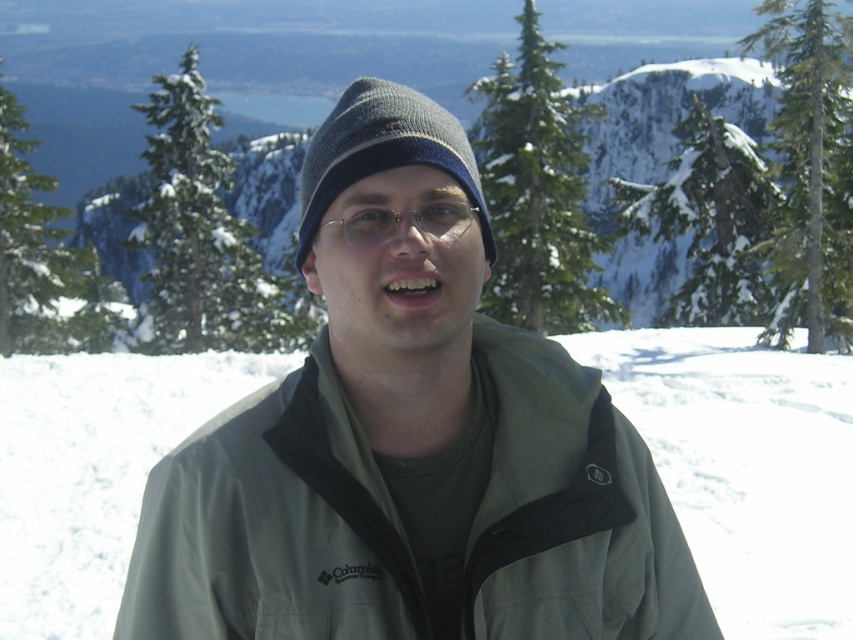
You are a photographer trying to capture the scene with a camera. You notice the green fabric jacket at center and the green textured pine at upper right. Which object should you focus on first if you want to highlight the smaller one in your photo?

The green fabric jacket at center has a smaller size compared to the green textured pine at upper right, so you should focus on the green fabric jacket at center first to highlight the smaller one in your photo.